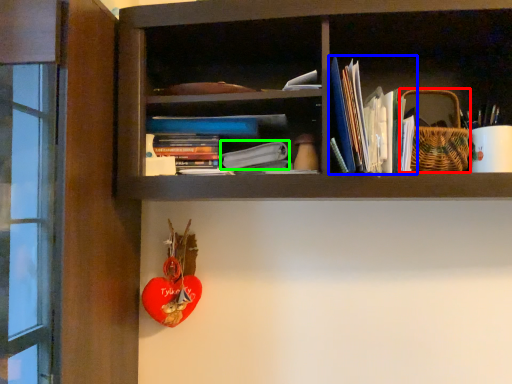
Question: Which is nearer to the basket (highlighted by a red box)? book (highlighted by a blue box) or paperback book (highlighted by a green box).

Choices:
 (A) book
 (B) paperback book

Answer: (A)